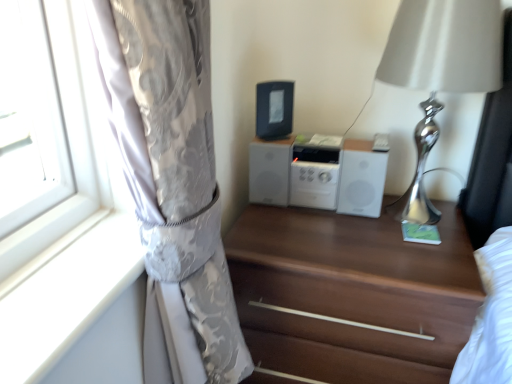
Question: Looking at their shapes, would you say brown wood chest of drawers at center is wider or thinner than white matte stereo at center?

Choices:
 (A) wide
 (B) thin

Answer: (A)

Question: From the image's perspective, relative to white matte stereo at center, is brown wood chest of drawers at center above or below?

Choices:
 (A) below
 (B) above

Answer: (A)

Question: Based on their relative distances, which object is nearer to the silky silver curtain at left?

Choices:
 (A) silver metallic table lamp at right
 (B) black plastic radio at center
 (C) white matte stereo at center
 (D) brown wood chest of drawers at center

Answer: (D)

Question: Which object is the closest to the white matte stereo at center?

Choices:
 (A) brown wood chest of drawers at center
 (B) black plastic radio at center
 (C) silver metallic table lamp at right
 (D) silky silver curtain at left

Answer: (B)